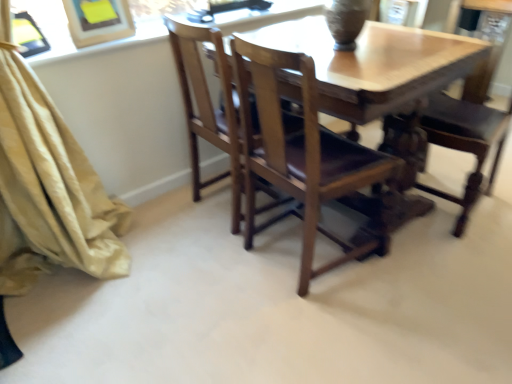
At what (x,y) coordinates should I click in order to perform the action: click on vacant area located to the right-hand side of beige fabric curtain at left. Please return your answer as a coordinate pair (x, y). Looking at the image, I should click on (183, 281).